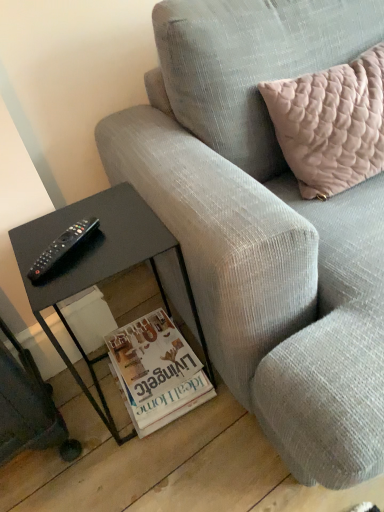
This screenshot has height=512, width=384. What are the coordinates of `free space to the left of black glass table at lower left` in the screenshot? It's located at (67, 431).